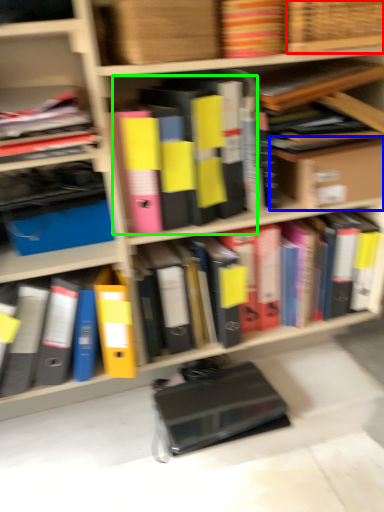
Question: Which is nearer to the basket (highlighted by a red box)? cardboard box (highlighted by a blue box) or book (highlighted by a green box).

Choices:
 (A) cardboard box
 (B) book

Answer: (B)